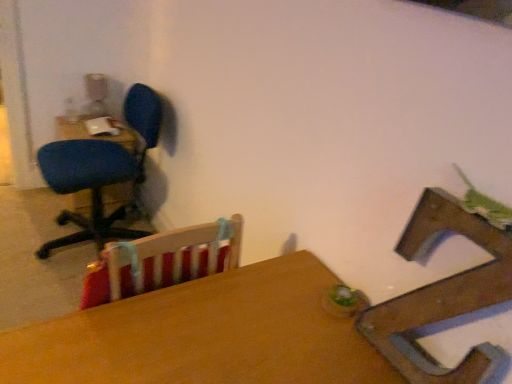
Question: Is blue fabric office chair at left, arranged as the first chair when viewed from the left, smaller than wooden chair at center, the second chair viewed from the back?

Choices:
 (A) no
 (B) yes

Answer: (A)

Question: Is blue fabric office chair at left, the 2th chair viewed from the right, positioned behind wooden chair at center, the second chair viewed from the back?

Choices:
 (A) no
 (B) yes

Answer: (B)

Question: Considering the relative sizes of blue fabric office chair at left, arranged as the first chair when viewed from the left, and wooden chair at center, which appears as the 1th chair when viewed from the front, in the image provided, is blue fabric office chair at left, arranged as the first chair when viewed from the left, thinner than wooden chair at center, which appears as the 1th chair when viewed from the front,?

Choices:
 (A) no
 (B) yes

Answer: (A)

Question: From the image's perspective, is blue fabric office chair at left, which is the 2th chair from front to back, located above wooden chair at center, positioned as the 1th chair in right-to-left order?

Choices:
 (A) yes
 (B) no

Answer: (A)

Question: Can you confirm if blue fabric office chair at left, arranged as the first chair when viewed from the left, is positioned to the left of wooden chair at center, the second chair viewed from the back?

Choices:
 (A) yes
 (B) no

Answer: (A)

Question: Considering the relative positions of wooden chair at center, the second chair viewed from the back, and matte blue chair at left, the 1th table when ordered from top to bottom, in the image provided, is wooden chair at center, the second chair viewed from the back, to the left or to the right of matte blue chair at left, the 1th table when ordered from top to bottom,?

Choices:
 (A) right
 (B) left

Answer: (A)

Question: From their relative heights in the image, would you say wooden chair at center, the second chair viewed from the back, is taller or shorter than matte blue chair at left, marked as the second table in a bottom-to-top arrangement?

Choices:
 (A) short
 (B) tall

Answer: (A)

Question: From a real-world perspective, is wooden chair at center, which appears as the 1th chair when viewed from the front, above or below matte blue chair at left, positioned as the second table in front-to-back order?

Choices:
 (A) below
 (B) above

Answer: (B)

Question: In terms of width, does wooden chair at center, the second chair viewed from the back, look wider or thinner when compared to matte blue chair at left, the 1th table viewed from the back?

Choices:
 (A) wide
 (B) thin

Answer: (B)

Question: Relative to blue fabric office chair at left, arranged as the first chair when viewed from the left, is wooden table at center, which ranks as the 2th table in left-to-right order, in front or behind?

Choices:
 (A) behind
 (B) front

Answer: (B)

Question: Is point (82, 317) positioned closer to the camera than point (143, 236)?

Choices:
 (A) farther
 (B) closer

Answer: (B)

Question: Is wooden table at center, which is the 2th table from top to bottom, to the left or to the right of blue fabric office chair at left, arranged as the first chair when viewed from the left, in the image?

Choices:
 (A) right
 (B) left

Answer: (A)

Question: Considering the positions of wooden table at center, the first table when ordered from right to left, and blue fabric office chair at left, arranged as the first chair when viewed from the left, in the image, is wooden table at center, the first table when ordered from right to left, bigger or smaller than blue fabric office chair at left, arranged as the first chair when viewed from the left,?

Choices:
 (A) big
 (B) small

Answer: (B)

Question: In terms of width, does blue fabric office chair at left, arranged as the first chair when viewed from the left, look wider or thinner when compared to matte blue chair at left, the 1th table viewed from the back?

Choices:
 (A) wide
 (B) thin

Answer: (A)

Question: Looking at the image, does blue fabric office chair at left, which is the 2th chair from front to back, seem bigger or smaller compared to matte blue chair at left, the 1th table when ordered from top to bottom?

Choices:
 (A) big
 (B) small

Answer: (A)